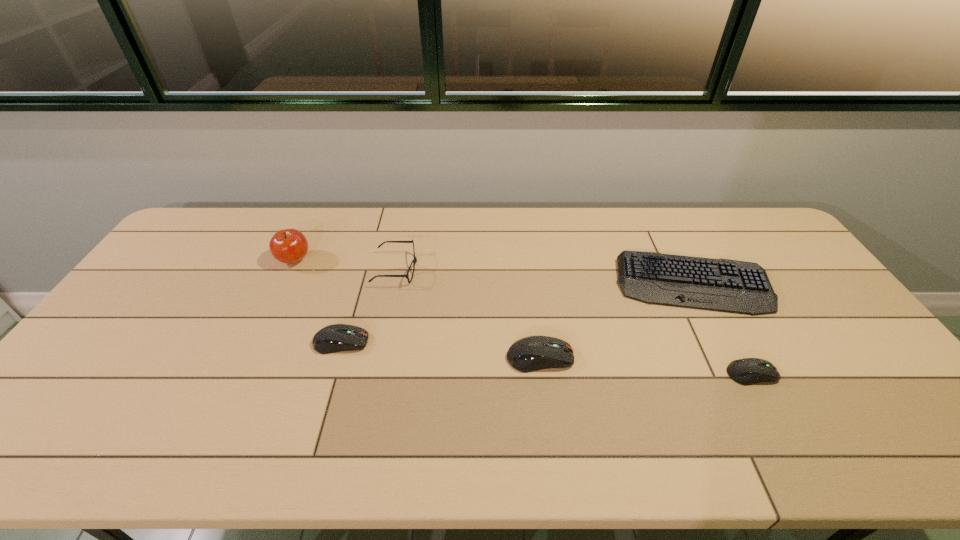
I want to click on vacant space positioned 0.140m on the front of the computer keyboard, so click(x=730, y=355).

You are a GUI agent. You are given a task and a screenshot of the screen. Output one action in this format:
    pyautogui.click(x=<x>, y=<y>)
    Task: Click on the free space located on the front of the apple
    The width and height of the screenshot is (960, 540).
    Given the screenshot: What is the action you would take?
    pyautogui.click(x=262, y=330)

At what (x,y) coordinates should I click in order to perform the action: click on vacant space situated 0.260m on the front-facing side of the spectacles. Please return your answer as a coordinate pair (x, y). Looking at the image, I should click on (499, 269).

Locate an element on the screen. Image resolution: width=960 pixels, height=540 pixels. object located in the near edge section of the desktop is located at coordinates (747, 371).

At what (x,y) coordinates should I click in order to perform the action: click on object located at the right edge. Please return your answer as a coordinate pair (x, y). Looking at the image, I should click on (726, 285).

The height and width of the screenshot is (540, 960). I want to click on vacant space at the far edge of the desktop, so click(x=533, y=238).

Image resolution: width=960 pixels, height=540 pixels. In the image, there is a desktop. What are the coordinates of `blank space at the near edge` in the screenshot? It's located at (137, 404).

The height and width of the screenshot is (540, 960). Identify the location of vacant space at the left edge of the desktop. (169, 293).

Where is `vacant space at the far left corner of the desktop`? The image size is (960, 540). vacant space at the far left corner of the desktop is located at coordinates (216, 245).

In the image, there is a desktop. What are the coordinates of `vacant space at the near left corner` in the screenshot? It's located at (97, 417).